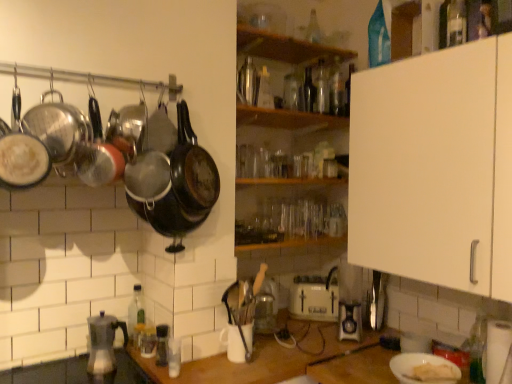
What are the coordinates of `vacant region under black matte wok at center, which is the 2th wok from right to left (from a real-world perspective)` in the screenshot? It's located at (182, 370).